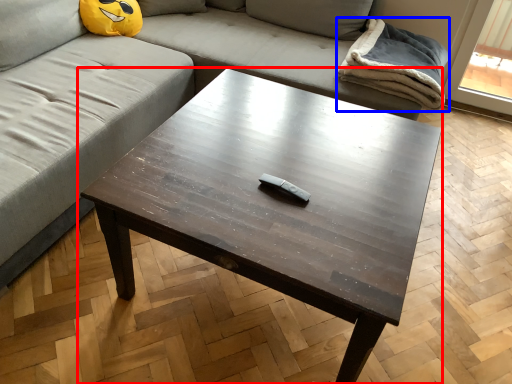
Question: Among these objects, which one is nearest to the camera, coffee table (highlighted by a red box) or blanket (highlighted by a blue box)?

Choices:
 (A) coffee table
 (B) blanket

Answer: (A)